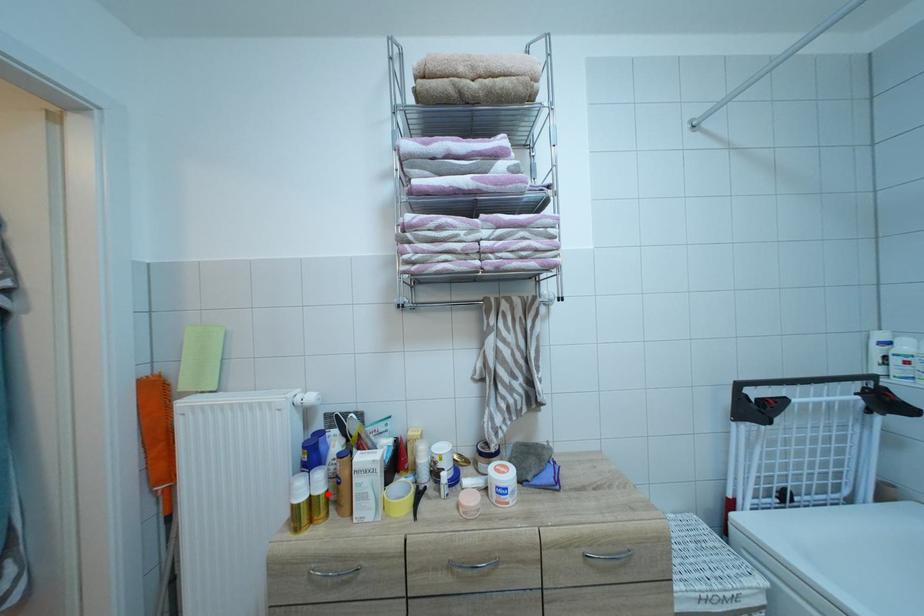
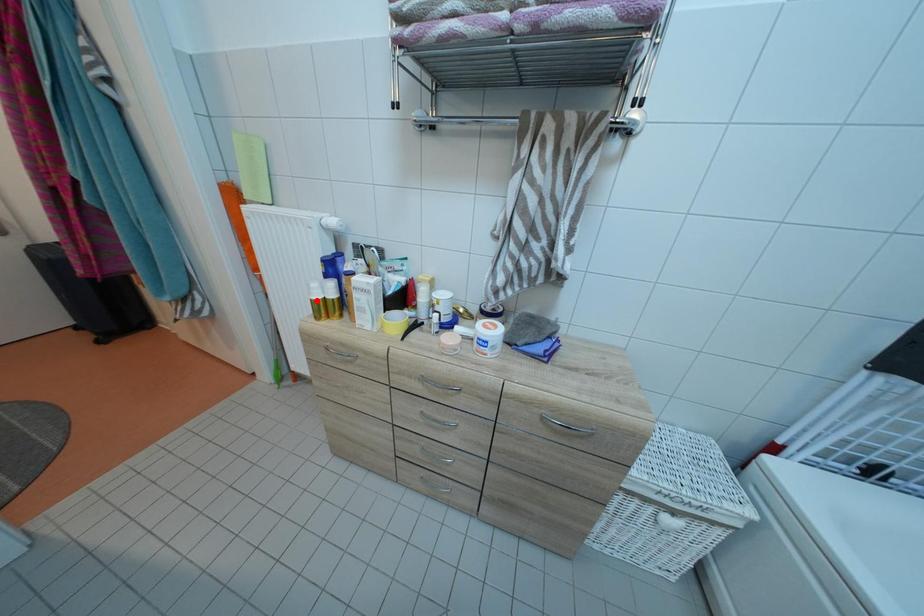
I am providing you with two images of the same scene from different viewpoints. A red point is marked on the first image and another point is marked on the second image. Does the point marked in image1 correspond to the same location as the one in image2?

No